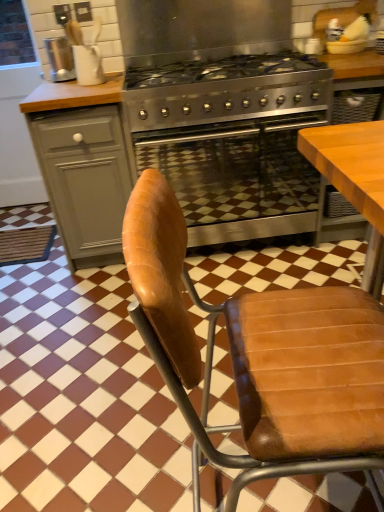
You are a GUI agent. You are given a task and a screenshot of the screen. Output one action in this format:
    pyautogui.click(x=<x>, y=<y>)
    Task: Click on the free space in front of matte gray cabinet at left
    
    Given the screenshot: What is the action you would take?
    pyautogui.click(x=89, y=298)